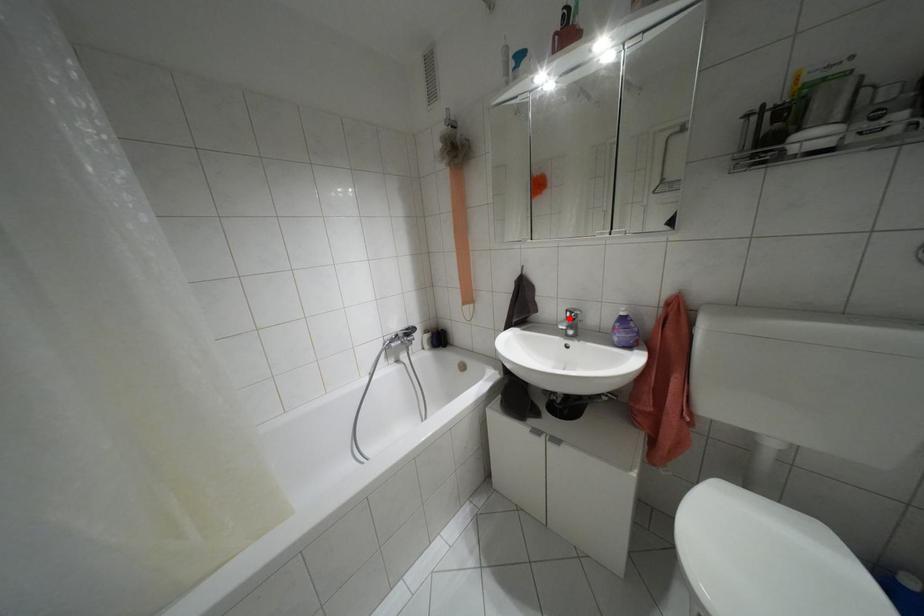
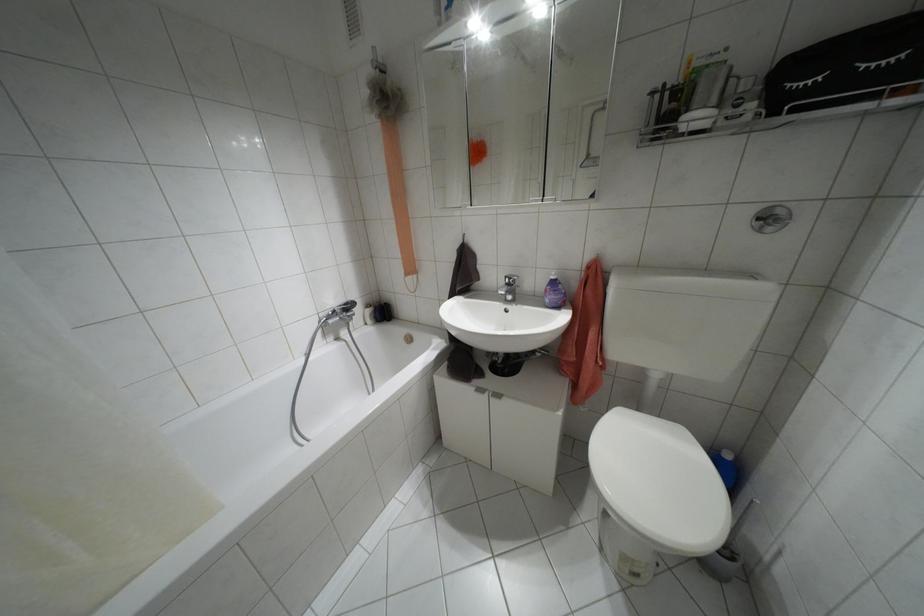
The point at the highlighted location is marked in the first image. Where is the corresponding point in the second image?

(507, 284)